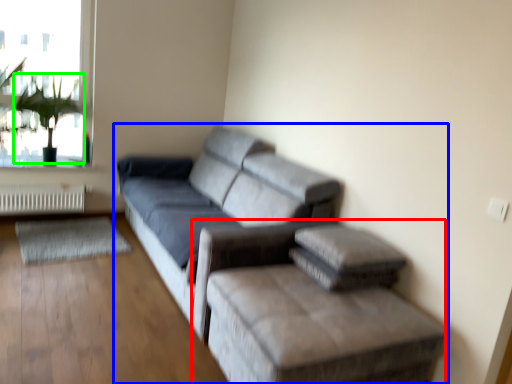
Question: Based on their relative distances, which object is farther from furniture (highlighted by a red box)? Choose from studio couch (highlighted by a blue box) and plant (highlighted by a green box).

Choices:
 (A) studio couch
 (B) plant

Answer: (B)